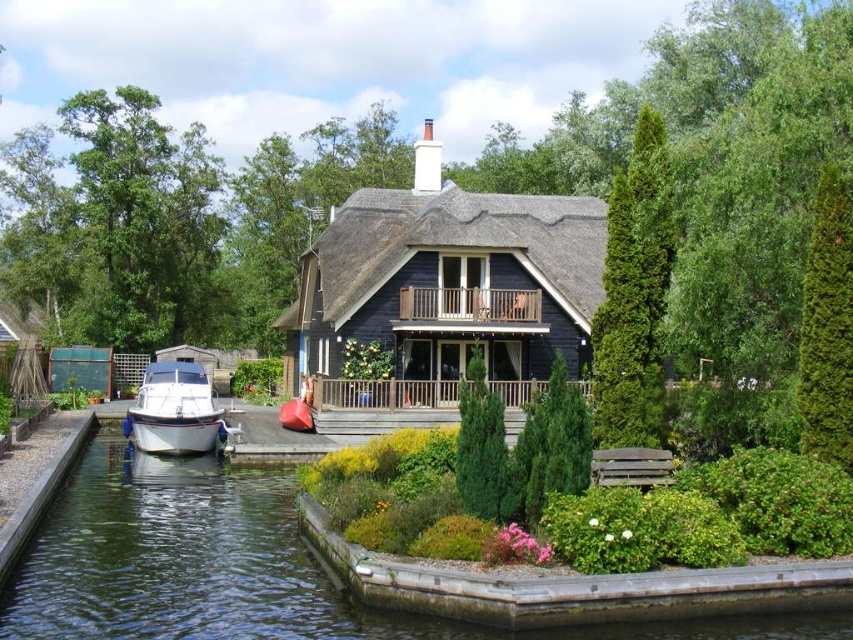
Consider the image. You are standing in front of the traditional house by the waterway. You want to sit on the wooden bench in the garden but first need to cross the clear water at lower left to reach it. Can you safely cross the water? Explain your reasoning.

The clear water at lower left is 29.96 meters away from the viewer, so it is too far to cross safely. You should find another path to reach the wooden bench without crossing the water.

You are a visitor standing in front of the dark blue wooden cottage at center. You want to sit on the green textured hedge at right. Is the hedge accessible from your current position?

The dark blue wooden cottage at center is above the green textured hedge at right, meaning the hedge is located below the cottage. Since the hedge is lower, you can easily step down to access it from the cottage.